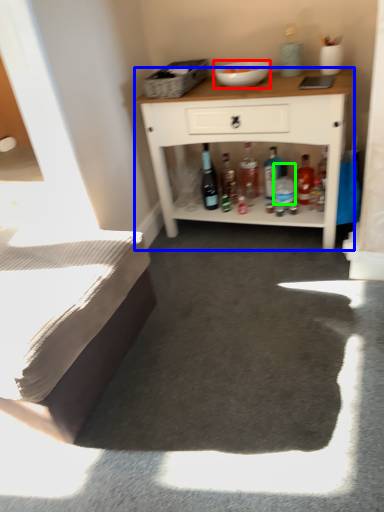
Question: Which object is positioned farthest from bowl (highlighted by a red box)? Select from cabinetry (highlighted by a blue box) and bottle (highlighted by a green box).

Choices:
 (A) cabinetry
 (B) bottle

Answer: (B)